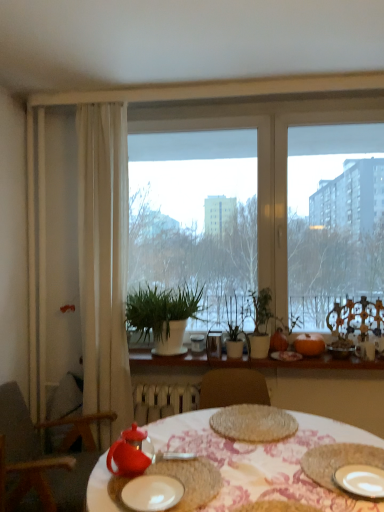
Identify the location of vacant area on the back side of white matte plate at center, marked as the first plate in a left-to-right arrangement. The width and height of the screenshot is (384, 512). (179, 463).